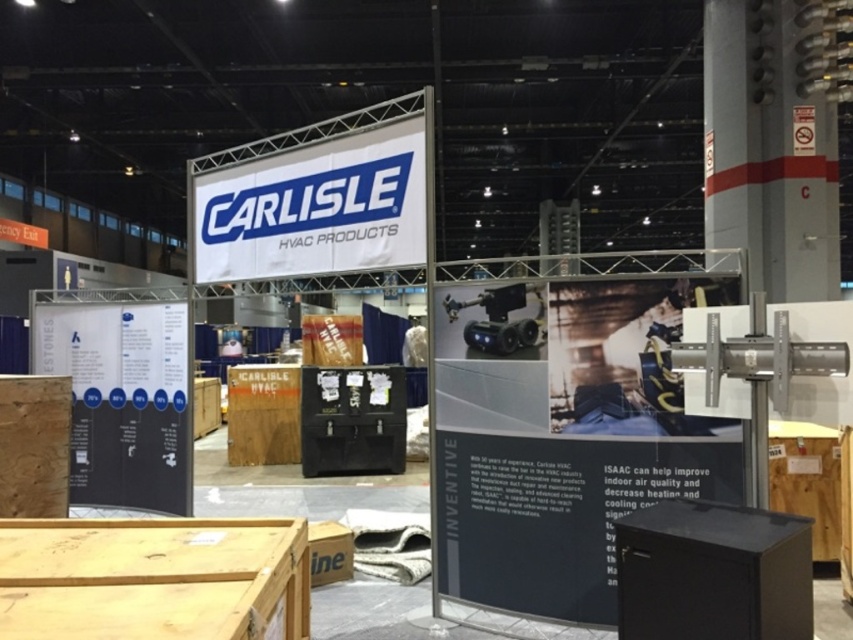
Question: Which point appears farthest from the camera in this image?

Choices:
 (A) (773, 227)
 (B) (256, 272)

Answer: (A)

Question: Does metallic gray pole at upper right have a greater width compared to white fabric banner at upper center?

Choices:
 (A) no
 (B) yes

Answer: (A)

Question: Which point is farther to the camera?

Choices:
 (A) (770, 164)
 (B) (248, 196)

Answer: (A)

Question: Which point is closer to the camera?

Choices:
 (A) metallic gray pole at upper right
 (B) white fabric banner at upper center

Answer: (B)

Question: Does metallic gray pole at upper right have a smaller size compared to white fabric banner at upper center?

Choices:
 (A) yes
 (B) no

Answer: (B)

Question: In this image, where is metallic gray pole at upper right located relative to white fabric banner at upper center?

Choices:
 (A) right
 (B) left

Answer: (A)